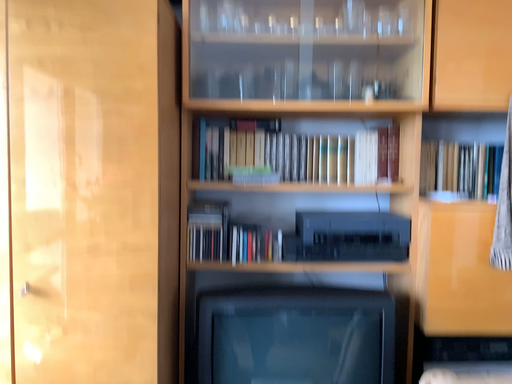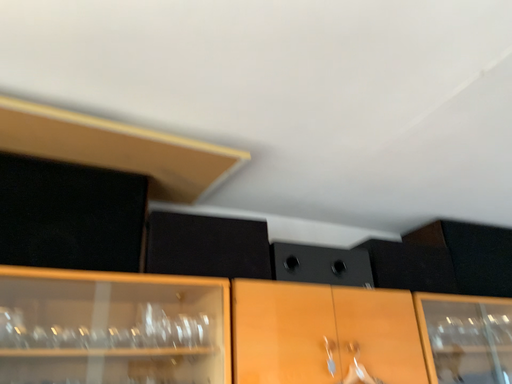
Question: Which way did the camera rotate in the video?

Choices:
 (A) rotated right
 (B) rotated left

Answer: (A)